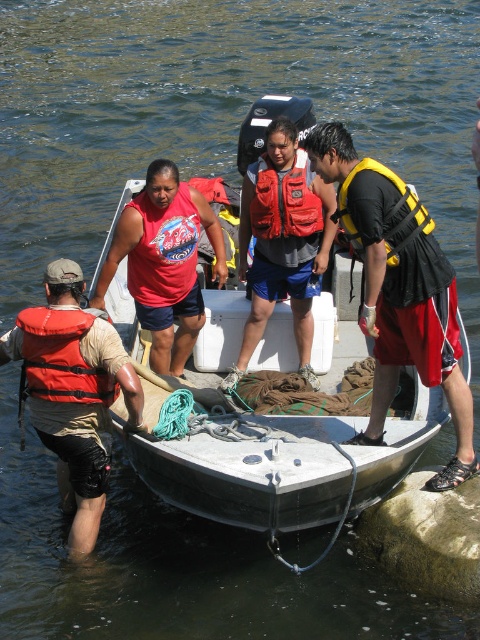
You are a safety inspector reviewing the rescue operation scene. You notice two orange life jackets, the matte orange life jacket at left and the orange life jacket at center. According to safety protocols, life jackets should be easily accessible and not stored below others. Are the positions of these life jackets compliant with safety standards?

The matte orange life jacket at left is below the orange life jacket at center, which violates safety protocols as it is stored underneath another life jacket, making it less accessible.

You are standing on the dock and see the matte orange life jacket at left. If you want to grab it, is it within your reach? Assume your maximum reach is 20 feet.

The matte orange life jacket at left is 20.67 feet away from the viewer. Since your maximum reach is 20 feet, you cannot reach it from the dock.